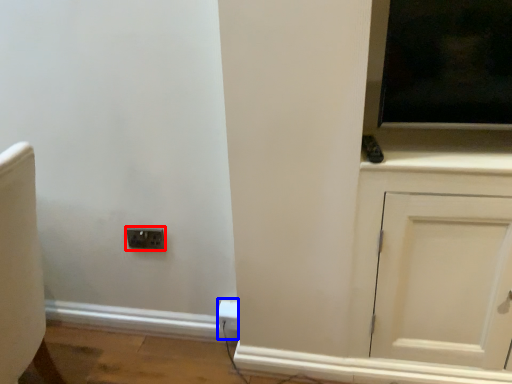
Question: Among these objects, which one is nearest to the camera, socket (highlighted by a red box) or electric outlet (highlighted by a blue box)?

Choices:
 (A) socket
 (B) electric outlet

Answer: (A)